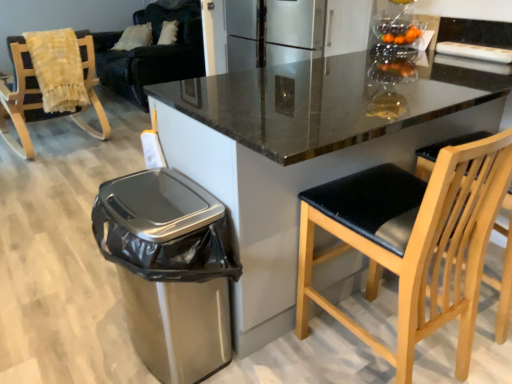
Question: Can you confirm if dark blue fabric couch at upper left is taller than satin silver trash can at lower left?

Choices:
 (A) no
 (B) yes

Answer: (B)

Question: From the image's perspective, is dark blue fabric couch at upper left over satin silver trash can at lower left?

Choices:
 (A) yes
 (B) no

Answer: (A)

Question: Considering the relative positions of dark blue fabric couch at upper left and satin silver trash can at lower left in the image provided, is dark blue fabric couch at upper left behind satin silver trash can at lower left?

Choices:
 (A) no
 (B) yes

Answer: (B)

Question: Is dark blue fabric couch at upper left located outside satin silver trash can at lower left?

Choices:
 (A) yes
 (B) no

Answer: (A)

Question: Can you confirm if dark blue fabric couch at upper left is positioned to the left of satin silver trash can at lower left?

Choices:
 (A) yes
 (B) no

Answer: (A)

Question: From a real-world perspective, is satin silver trash can at lower left positioned above or below black leather chair at right, the 1th chair when ordered from bottom to top?

Choices:
 (A) above
 (B) below

Answer: (B)

Question: Considering their positions, is satin silver trash can at lower left located in front of or behind black leather chair at right, arranged as the second chair when viewed from the back?

Choices:
 (A) behind
 (B) front

Answer: (A)

Question: Is satin silver trash can at lower left wider or thinner than black leather chair at right, arranged as the second chair when viewed from the back?

Choices:
 (A) thin
 (B) wide

Answer: (A)

Question: From the image's perspective, relative to black leather chair at right, arranged as the second chair when viewed from the back, is satin silver trash can at lower left above or below?

Choices:
 (A) above
 (B) below

Answer: (B)

Question: From the image's perspective, is black leather chair at right, arranged as the second chair when viewed from the back, positioned above or below dark blue fabric couch at upper left?

Choices:
 (A) above
 (B) below

Answer: (B)

Question: Considering their positions, is black leather chair at right, the 1th chair when ordered from bottom to top, located in front of or behind dark blue fabric couch at upper left?

Choices:
 (A) front
 (B) behind

Answer: (A)

Question: Is point 409,264 positioned closer to the camera than point 157,13?

Choices:
 (A) closer
 (B) farther

Answer: (A)

Question: Is black leather chair at right, positioned as the first chair in right-to-left order, spatially inside dark blue fabric couch at upper left, or outside of it?

Choices:
 (A) outside
 (B) inside

Answer: (A)

Question: Does point (190, 29) appear closer or farther from the camera than point (342, 218)?

Choices:
 (A) farther
 (B) closer

Answer: (A)

Question: In terms of size, does dark blue fabric couch at upper left appear bigger or smaller than black leather chair at right, arranged as the second chair when viewed from the back?

Choices:
 (A) small
 (B) big

Answer: (B)